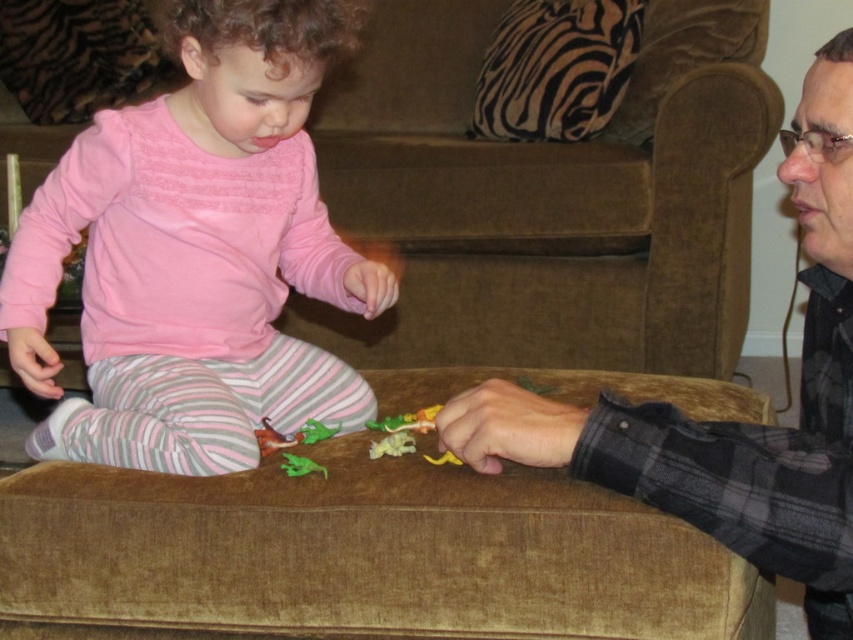
You are a delivery robot trying to navigate to the living room coffee table located at the center of the room. There is a pink soft fabric toddler at lower left represented by point (196, 253). Can you safely move around the toddler to reach the coffee table?

The pink soft fabric toddler at lower left is represented by point (196, 253), so you can safely move around them to reach the coffee table as long as you maintain a safe distance.

You are a parent trying to clean up the living room. You see the pink soft fabric toddler at lower left and the matte black shirt at lower right lying on the floor. Which item is closer to the left side of the room?

The pink soft fabric toddler at lower left is closer to the left side of the room because it is positioned to the left of the matte black shirt at lower right.